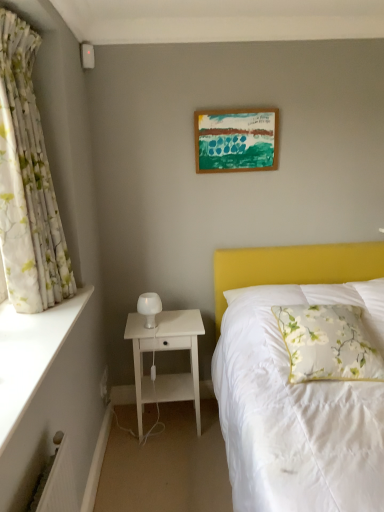
Question: From the image's perspective, is white wood nightstand at lower left under floral fabric pillow at right?

Choices:
 (A) yes
 (B) no

Answer: (A)

Question: Does white wood nightstand at lower left touch floral fabric pillow at right?

Choices:
 (A) no
 (B) yes

Answer: (A)

Question: Is floral fabric pillow at right surrounded by white wood nightstand at lower left?

Choices:
 (A) no
 (B) yes

Answer: (A)

Question: Is white wood nightstand at lower left smaller than floral fabric pillow at right?

Choices:
 (A) yes
 (B) no

Answer: (B)

Question: Is white wood nightstand at lower left looking in the opposite direction of floral fabric pillow at right?

Choices:
 (A) yes
 (B) no

Answer: (B)

Question: In the image, is white wood nightstand at lower left positioned in front of or behind wooden picture frame at upper center?

Choices:
 (A) front
 (B) behind

Answer: (A)

Question: Looking at their shapes, would you say white wood nightstand at lower left is wider or thinner than wooden picture frame at upper center?

Choices:
 (A) wide
 (B) thin

Answer: (A)

Question: Considering the positions of point (173, 374) and point (223, 122), is point (173, 374) closer or farther from the camera than point (223, 122)?

Choices:
 (A) closer
 (B) farther

Answer: (B)

Question: Is white wood nightstand at lower left spatially inside wooden picture frame at upper center, or outside of it?

Choices:
 (A) outside
 (B) inside

Answer: (A)

Question: Is white floral fabric curtain at left wider or thinner than white frosted glass table lamp at left?

Choices:
 (A) wide
 (B) thin

Answer: (A)

Question: Is white floral fabric curtain at left spatially inside white frosted glass table lamp at left, or outside of it?

Choices:
 (A) outside
 (B) inside

Answer: (A)

Question: Considering the positions of white floral fabric curtain at left and white frosted glass table lamp at left in the image, is white floral fabric curtain at left bigger or smaller than white frosted glass table lamp at left?

Choices:
 (A) small
 (B) big

Answer: (B)

Question: From a real-world perspective, is white floral fabric curtain at left physically located above or below white frosted glass table lamp at left?

Choices:
 (A) below
 (B) above

Answer: (B)

Question: Considering the positions of white frosted glass table lamp at left and white smooth ledge at left in the image, is white frosted glass table lamp at left bigger or smaller than white smooth ledge at left?

Choices:
 (A) big
 (B) small

Answer: (B)

Question: Considering their positions, is white frosted glass table lamp at left located in front of or behind white smooth ledge at left?

Choices:
 (A) behind
 (B) front

Answer: (A)